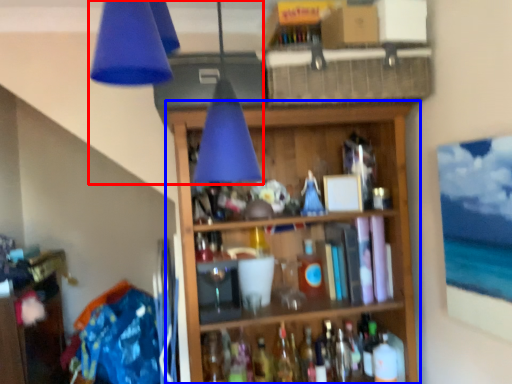
Question: Among these objects, which one is nearest to the camera, lamp (highlighted by a red box) or shelf (highlighted by a blue box)?

Choices:
 (A) lamp
 (B) shelf

Answer: (A)